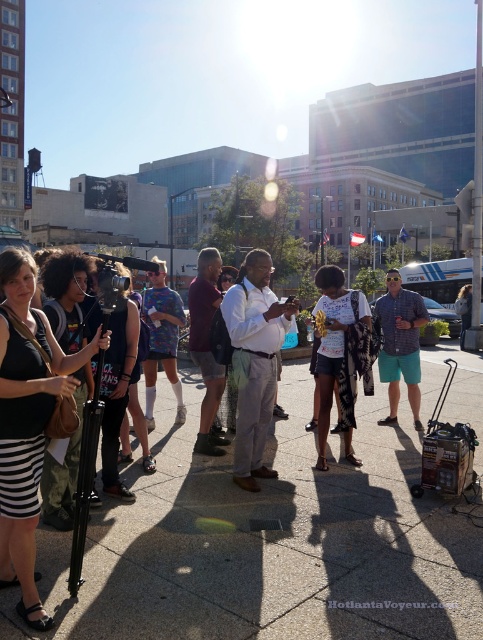
You are a photographer trying to capture a clear shot of the white shirt at center and the maroon fabric shirt at center. Which shirt should you focus on first if you want to ensure the thinner one is in focus?

The white shirt at center is thinner than the maroon fabric shirt at center, so you should focus on the white shirt at center first to ensure it is in focus.

You are a photographer trying to capture a clear image of both the white shirt at center and the white matte shirt at center. Since the sun is high and creating lens flares, which of the two shirts might be easier to see in your photo due to its size?

The white shirt at center has a greater height compared to the white matte shirt at center, so it might be easier to see in the photo because of its larger size.